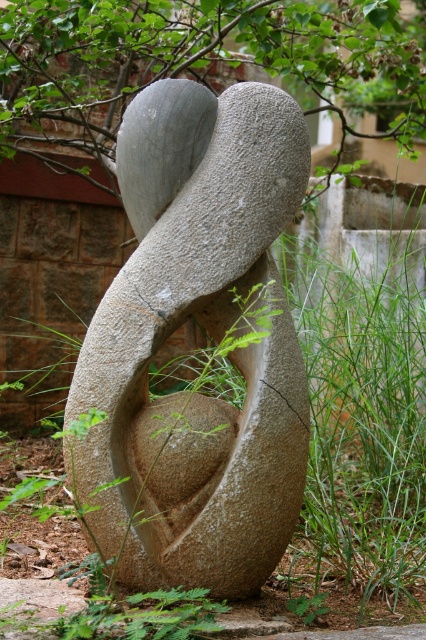
Question: Which of the following is the closest to the observer?

Choices:
 (A) granite sculpture at center
 (B) green grass at center

Answer: (B)

Question: Is granite sculpture at center thinner than green grass at center?

Choices:
 (A) no
 (B) yes

Answer: (A)

Question: Is granite sculpture at center further to the viewer compared to green grass at center?

Choices:
 (A) yes
 (B) no

Answer: (A)

Question: Is granite sculpture at center positioned in front of green grass at center?

Choices:
 (A) no
 (B) yes

Answer: (A)

Question: Which of the following is the farthest from the observer?

Choices:
 (A) green grass at center
 (B) granite sculpture at center

Answer: (B)

Question: Among these objects, which one is farthest from the camera?

Choices:
 (A) granite sculpture at center
 (B) green grass at center

Answer: (A)